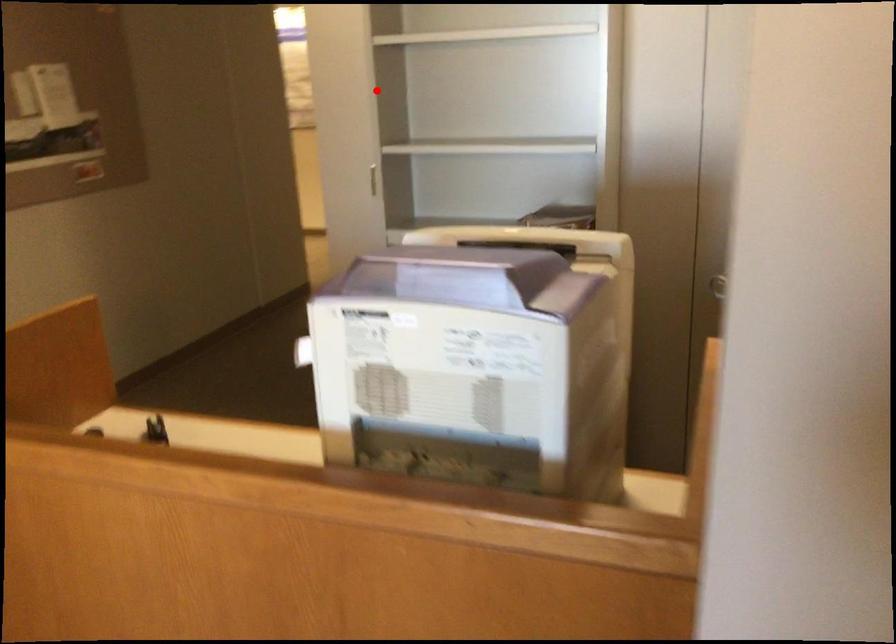
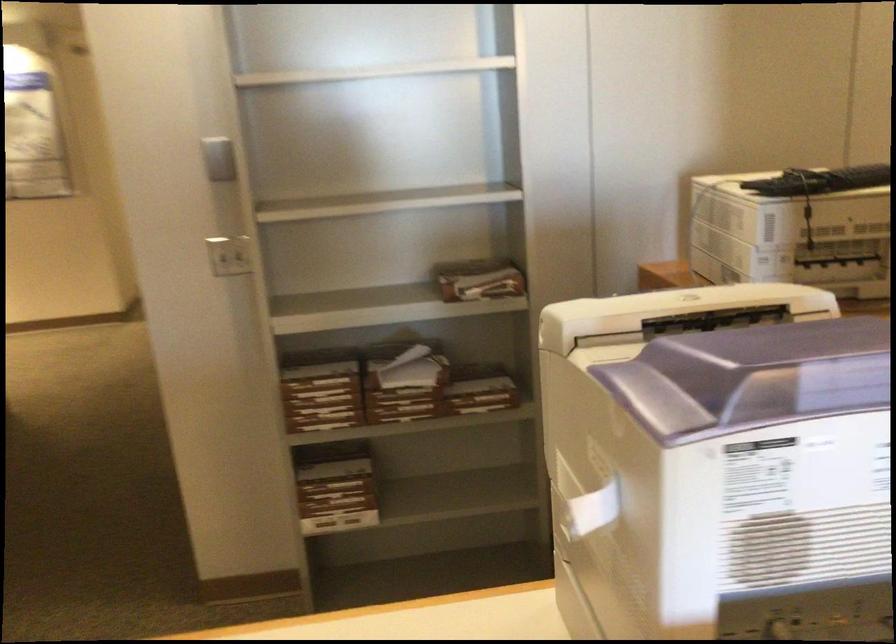
Where in the second image is the point corresponding to the highlighted location from the first image?

(219, 158)